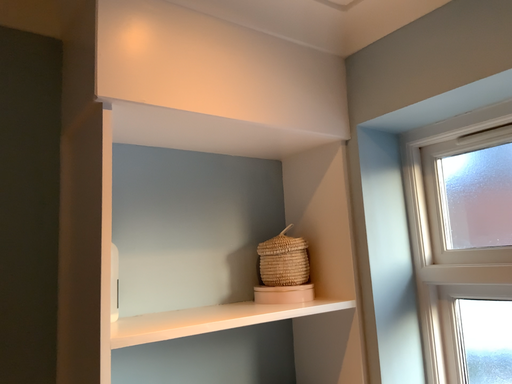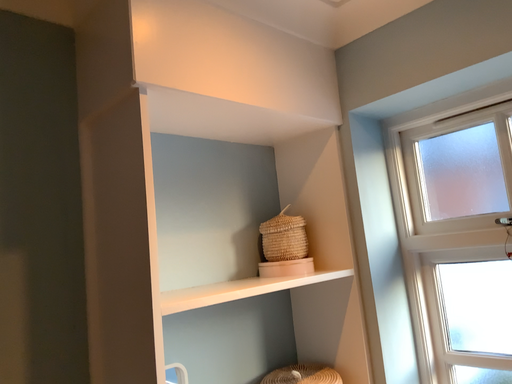
Question: How did the camera likely rotate when shooting the video?

Choices:
 (A) rotated right
 (B) rotated left

Answer: (A)